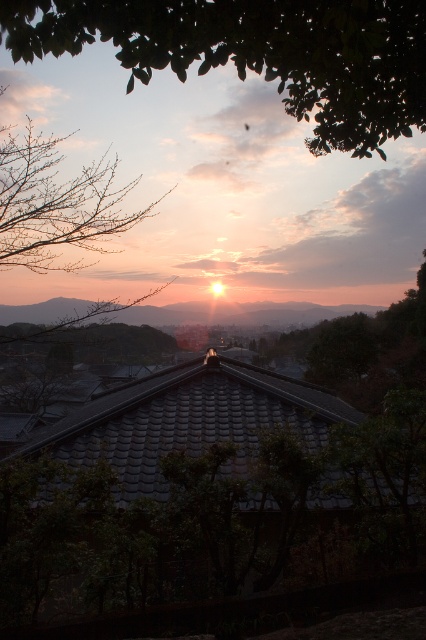
Question: Can you confirm if green leafy tree at upper center is positioned below bare branches at upper left?

Choices:
 (A) no
 (B) yes

Answer: (A)

Question: Can you confirm if green leafy tree at upper center is thinner than bare branches at upper left?

Choices:
 (A) yes
 (B) no

Answer: (A)

Question: Is green leafy tree at upper center wider than bare branches at upper left?

Choices:
 (A) no
 (B) yes

Answer: (A)

Question: Which object is closer to the camera taking this photo?

Choices:
 (A) bare branches at upper left
 (B) green leafy tree at upper center

Answer: (B)